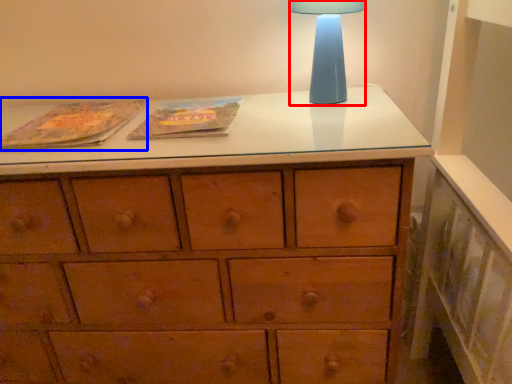
Question: Which object is closer to the camera taking this photo, table lamp (highlighted by a red box) or paperback book (highlighted by a blue box)?

Choices:
 (A) table lamp
 (B) paperback book

Answer: (B)